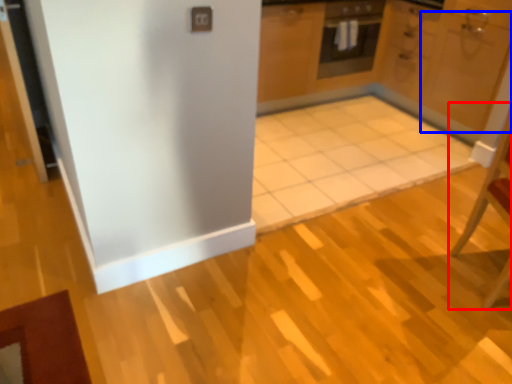
Question: Among these objects, which one is nearest to the camera, chair (highlighted by a red box) or door (highlighted by a blue box)?

Choices:
 (A) chair
 (B) door

Answer: (A)